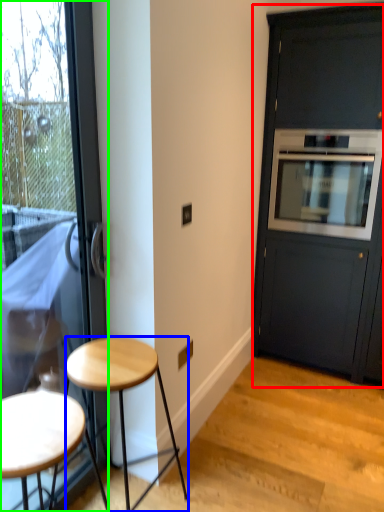
Question: Which object is positioned closest to cabinetry (highlighted by a red box)? Select from stool (highlighted by a blue box) and door (highlighted by a green box).

Choices:
 (A) stool
 (B) door

Answer: (B)